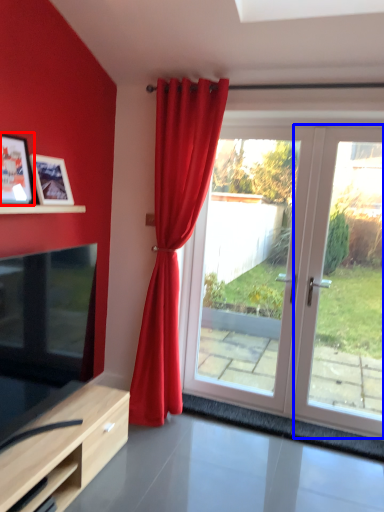
Question: Which object is closer to the camera taking this photo, picture frame (highlighted by a red box) or glass door (highlighted by a blue box)?

Choices:
 (A) picture frame
 (B) glass door

Answer: (A)